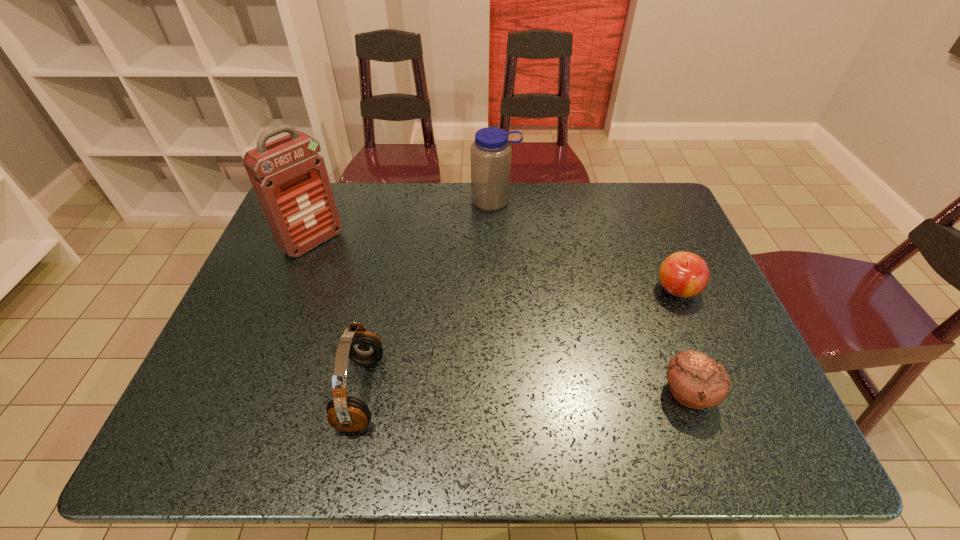
Identify the location of headset. (345, 413).

Identify the location of the third shortest object. Image resolution: width=960 pixels, height=540 pixels. (345, 413).

Where is `muffin`? This screenshot has width=960, height=540. muffin is located at coordinates (696, 381).

Image resolution: width=960 pixels, height=540 pixels. I want to click on apple, so click(x=682, y=274).

The height and width of the screenshot is (540, 960). Find the location of `the tallest object`. the tallest object is located at coordinates (290, 179).

The height and width of the screenshot is (540, 960). In order to click on the first-aid kit in this screenshot , I will do `click(290, 179)`.

The width and height of the screenshot is (960, 540). Identify the location of the second tallest object. (491, 151).

This screenshot has width=960, height=540. Find the location of `the third object from right to left`. the third object from right to left is located at coordinates (491, 151).

At what (x,y) coordinates should I click in order to perform the action: click on free space located on the ear cups of the fourth object from right to left. Please return your answer as a coordinate pair (x, y). This screenshot has width=960, height=540. Looking at the image, I should click on (199, 392).

At what (x,y) coordinates should I click in order to perform the action: click on free space located 0.270m on the ear cups of the fourth object from right to left. Please return your answer as a coordinate pair (x, y). Looking at the image, I should click on (217, 392).